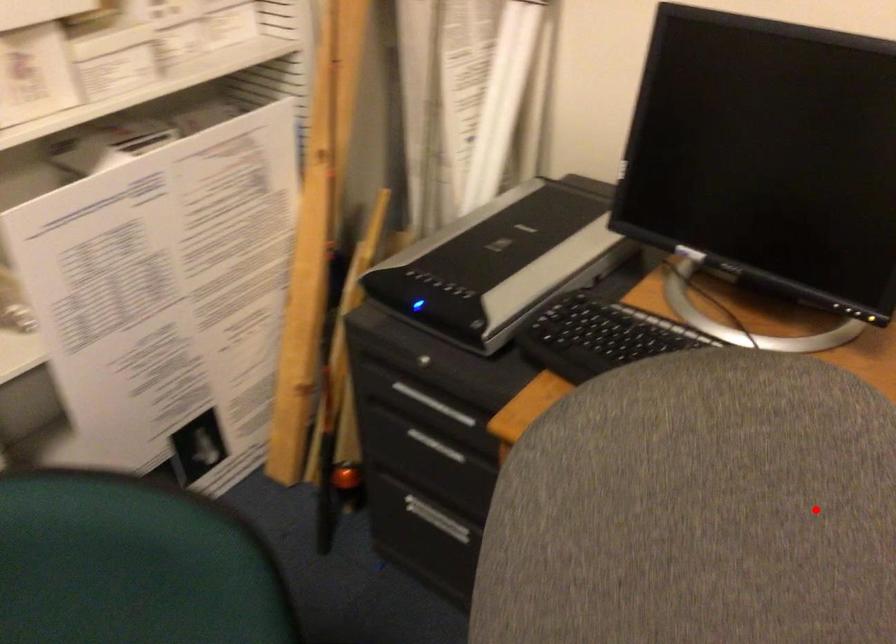
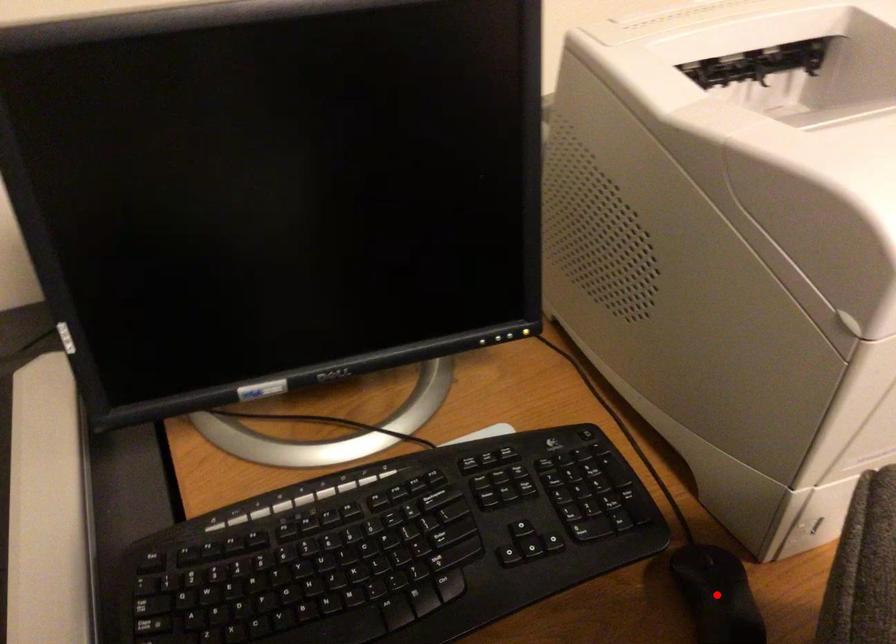
I am providing you with two images of the same scene from different viewpoints. A red point is marked on the first image and another point is marked on the second image. Does the point marked in image1 correspond to the same location as the one in image2?

Yes